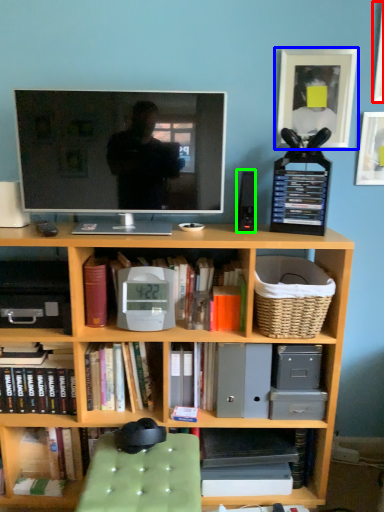
Question: Estimate the real-world distances between objects in this image. Which object is farther from picture frame (highlighted by a red box), picture frame (highlighted by a blue box) or speaker (highlighted by a green box)?

Choices:
 (A) picture frame
 (B) speaker

Answer: (B)